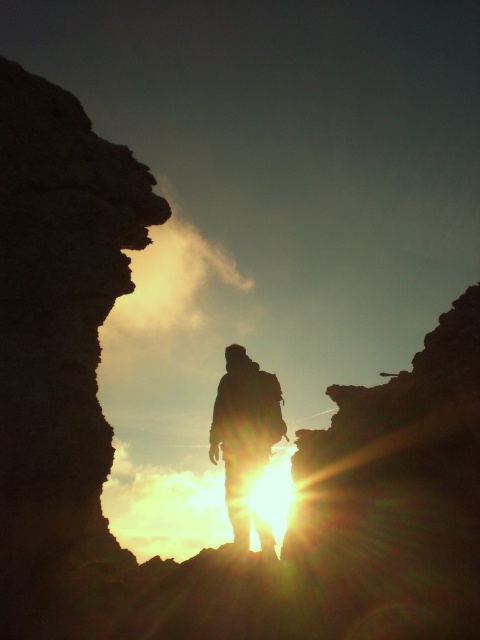
Which of these two, rugged stone cliff at left or silhouette backpack at center, stands taller?

Standing taller between the two is rugged stone cliff at left.

Is rugged stone cliff at left wider than silhouette backpack at center?

Yes.

This screenshot has height=640, width=480. In order to click on rugged stone cliff at left in this screenshot , I will do `click(57, 328)`.